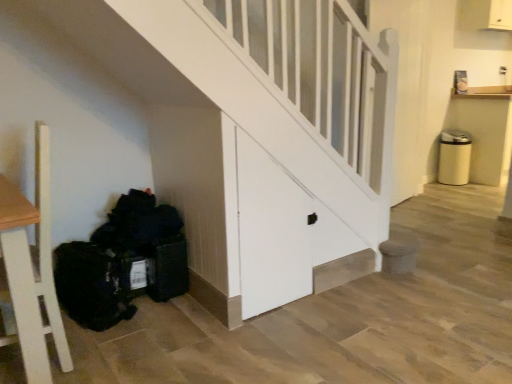
Identify the location of black fabric bag at lower left. (123, 263).

What do you see at coordinates (123, 263) in the screenshot?
I see `black fabric bag at lower left` at bounding box center [123, 263].

The height and width of the screenshot is (384, 512). What do you see at coordinates (271, 231) in the screenshot?
I see `white wood door at center` at bounding box center [271, 231].

Measure the distance between point (292, 193) and camera.

The depth of point (292, 193) is 2.11 meters.

What is the approximate height of white wood door at center?

3.37 feet.

Identify the location of white wood door at center. The width and height of the screenshot is (512, 384). (271, 231).

Find the location of a particular element. black fabric bag at lower left is located at coordinates (123, 263).

Consider the image. Can you confirm if white wood door at center is positioned to the right of black fabric bag at lower left?

Correct, you'll find white wood door at center to the right of black fabric bag at lower left.

Which object is closer to the camera taking this photo, white wood door at center or black fabric bag at lower left?

white wood door at center is closer to the camera.

Is point (293, 240) positioned after point (120, 307)?

That is True.

From the image's perspective, between white wood door at center and black fabric bag at lower left, which one is located above?

white wood door at center is shown above in the image.

From a real-world perspective, is white wood door at center physically above black fabric bag at lower left?

Yes, from a real-world perspective, white wood door at center is on top of black fabric bag at lower left.

Is white wood door at center thinner than black fabric bag at lower left?

Correct, the width of white wood door at center is less than that of black fabric bag at lower left.

Can you confirm if white wood door at center is taller than black fabric bag at lower left?

Correct, white wood door at center is much taller as black fabric bag at lower left.

Based on their sizes in the image, would you say white wood door at center is bigger or smaller than black fabric bag at lower left?

white wood door at center is smaller than black fabric bag at lower left.

Choose the correct answer: Is white wood door at center inside black fabric bag at lower left or outside it?

white wood door at center exists outside the volume of black fabric bag at lower left.

Is white wood door at center not close to black fabric bag at lower left?

No, there isn't a large distance between white wood door at center and black fabric bag at lower left.

Is white wood door at center oriented away from black fabric bag at lower left?

No, white wood door at center is not facing away from black fabric bag at lower left.

Can you tell me how much white wood door at center and black fabric bag at lower left differ in facing direction?

The angular difference between white wood door at center and black fabric bag at lower left is 2.02 degrees.

In the image, there is a white wood door at center. Where is `garbage below it (from a real-world perspective)`? This screenshot has width=512, height=384. garbage below it (from a real-world perspective) is located at coordinates (123, 263).

Which object is positioned more to the left, black fabric bag at lower left or white wood door at center?

black fabric bag at lower left is more to the left.

Is black fabric bag at lower left further to camera compared to white wood door at center?

Yes.

Which is in front, point (85, 248) or point (270, 295)?

The point (85, 248) is more forward.

From the image's perspective, which one is positioned higher, black fabric bag at lower left or white wood door at center?

white wood door at center, from the image's perspective.

From a real-world perspective, is black fabric bag at lower left on top of white wood door at center?

Incorrect, from a real-world perspective, black fabric bag at lower left is lower than white wood door at center.

Which object is thinner, black fabric bag at lower left or white wood door at center?

Thinner between the two is white wood door at center.

Considering the sizes of black fabric bag at lower left and white wood door at center in the image, is black fabric bag at lower left taller or shorter than white wood door at center?

Considering their sizes, black fabric bag at lower left has less height than white wood door at center.

Does black fabric bag at lower left have a larger size compared to white wood door at center?

Yes.

Does black fabric bag at lower left contain white wood door at center?

That's incorrect, white wood door at center is not inside black fabric bag at lower left.

Is black fabric bag at lower left not near white wood door at center?

They are positioned close to each other.

Is black fabric bag at lower left turned away from white wood door at center?

No.

What's the angular difference between black fabric bag at lower left and white wood door at center's facing directions?

The angular difference between black fabric bag at lower left and white wood door at center is 2.02 degrees.

How distant is black fabric bag at lower left from white wood door at center?

23.60 inches.

Locate an element on the screen. The width and height of the screenshot is (512, 384). door lying on the right of black fabric bag at lower left is located at coordinates (271, 231).

Locate an element on the screen. The width and height of the screenshot is (512, 384). garbage on the left side of white wood door at center is located at coordinates (123, 263).

Find the location of `door located above the black fabric bag at lower left (from a real-world perspective)`. door located above the black fabric bag at lower left (from a real-world perspective) is located at coordinates (271, 231).